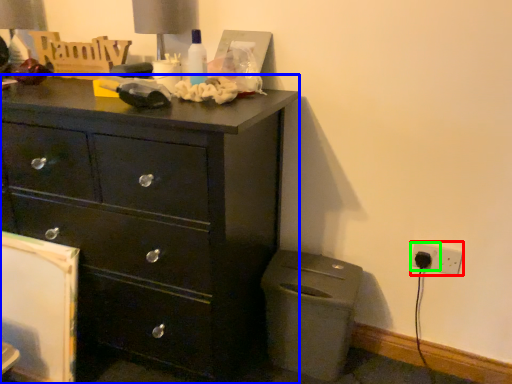
Question: Based on their relative distances, which object is nearer to electric outlet (highlighted by a red box)? Choose from chest of drawers (highlighted by a blue box) and electric outlet (highlighted by a green box).

Choices:
 (A) chest of drawers
 (B) electric outlet

Answer: (B)